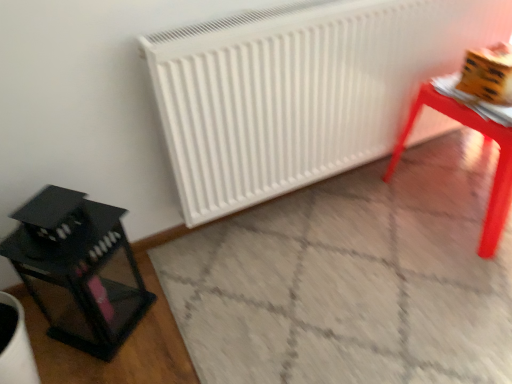
Question: Does black glass lantern at left appear on the right side of white matte radiator at center?

Choices:
 (A) yes
 (B) no

Answer: (B)

Question: Does black glass lantern at left have a smaller size compared to white matte radiator at center?

Choices:
 (A) no
 (B) yes

Answer: (B)

Question: From the image's perspective, is black glass lantern at left below white matte radiator at center?

Choices:
 (A) no
 (B) yes

Answer: (B)

Question: Is black glass lantern at left to the left of white matte radiator at center from the viewer's perspective?

Choices:
 (A) no
 (B) yes

Answer: (B)

Question: Is black glass lantern at left directly adjacent to white matte radiator at center?

Choices:
 (A) no
 (B) yes

Answer: (A)

Question: Can you confirm if black glass lantern at left is wider than white matte radiator at center?

Choices:
 (A) yes
 (B) no

Answer: (A)

Question: Does smooth glossy table at right have a greater width compared to white matte radiator at center?

Choices:
 (A) no
 (B) yes

Answer: (B)

Question: Does smooth glossy table at right have a smaller size compared to white matte radiator at center?

Choices:
 (A) no
 (B) yes

Answer: (A)

Question: Is smooth glossy table at right oriented away from white matte radiator at center?

Choices:
 (A) yes
 (B) no

Answer: (A)

Question: Considering the relative sizes of smooth glossy table at right and white matte radiator at center in the image provided, is smooth glossy table at right thinner than white matte radiator at center?

Choices:
 (A) no
 (B) yes

Answer: (A)

Question: Is smooth glossy table at right far from white matte radiator at center?

Choices:
 (A) no
 (B) yes

Answer: (A)

Question: From the image's perspective, is smooth glossy table at right located above white matte radiator at center?

Choices:
 (A) yes
 (B) no

Answer: (B)

Question: From a real-world perspective, is smooth glossy table at right under black glass lantern at left?

Choices:
 (A) no
 (B) yes

Answer: (B)